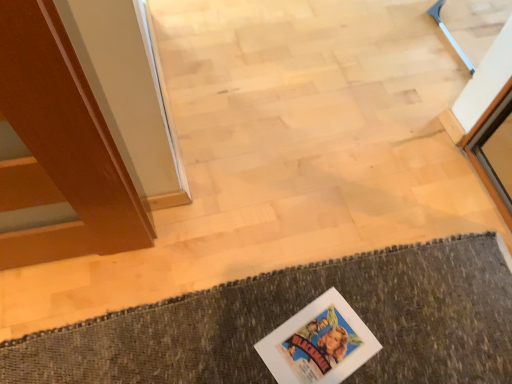
Where is `free location above colorful paper comic book at lower center (from a real-world perspective)`? This screenshot has width=512, height=384. free location above colorful paper comic book at lower center (from a real-world perspective) is located at coordinates (320, 344).